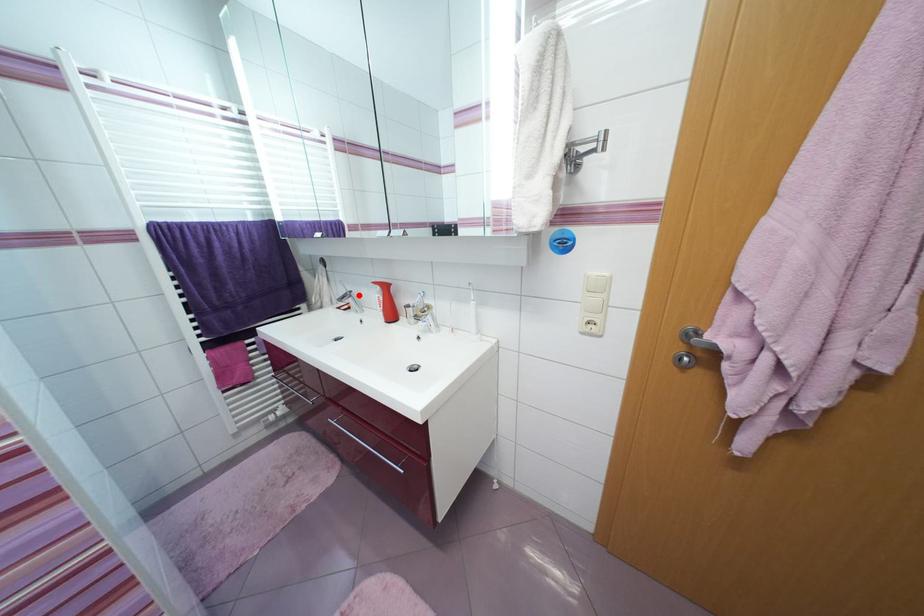
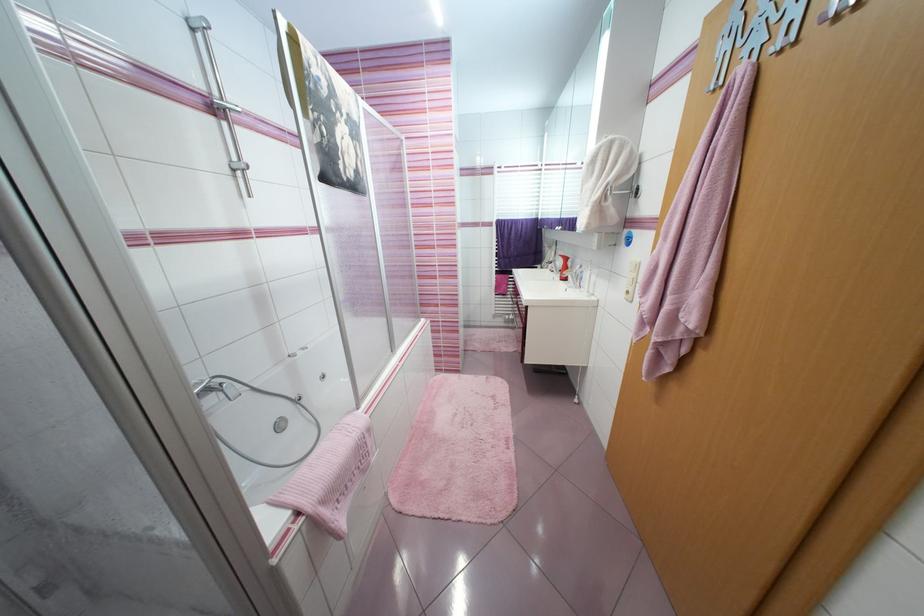
Question: A red point is marked in image1. In image2, is the corresponding 3D point closer to the camera or farther? Reply with the corresponding letter.

Choices:
 (A) The corresponding 3D point is closer.
 (B) The corresponding 3D point is farther.

Answer: (A)